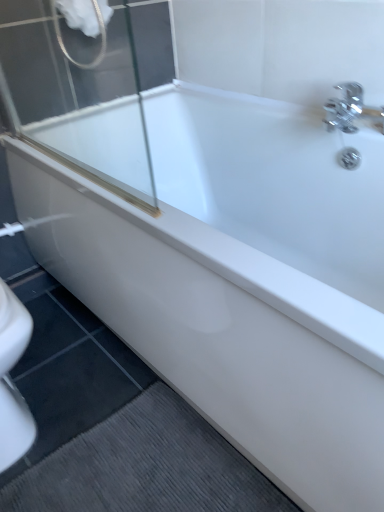
Question: From a real-world perspective, is white matte shower head at upper left beneath gray textured bath mat at lower left?

Choices:
 (A) yes
 (B) no

Answer: (B)

Question: Would you say white matte shower head at upper left is a long distance from gray textured bath mat at lower left?

Choices:
 (A) no
 (B) yes

Answer: (B)

Question: Is white matte shower head at upper left touching gray textured bath mat at lower left?

Choices:
 (A) no
 (B) yes

Answer: (A)

Question: Is white matte shower head at upper left aimed at gray textured bath mat at lower left?

Choices:
 (A) no
 (B) yes

Answer: (A)

Question: Can you confirm if white matte shower head at upper left is shorter than gray textured bath mat at lower left?

Choices:
 (A) yes
 (B) no

Answer: (B)

Question: Can you confirm if white matte shower head at upper left is positioned to the right of gray textured bath mat at lower left?

Choices:
 (A) yes
 (B) no

Answer: (B)

Question: Is gray textured bath mat at lower left directly adjacent to white matte shower head at upper left?

Choices:
 (A) no
 (B) yes

Answer: (A)

Question: Is gray textured bath mat at lower left not within white matte shower head at upper left?

Choices:
 (A) no
 (B) yes

Answer: (B)

Question: Can you confirm if gray textured bath mat at lower left is smaller than white matte shower head at upper left?

Choices:
 (A) yes
 (B) no

Answer: (A)

Question: Could white matte shower head at upper left be considered to be inside gray textured bath mat at lower left?

Choices:
 (A) no
 (B) yes

Answer: (A)

Question: Considering the relative positions of gray textured bath mat at lower left and white matte shower head at upper left in the image provided, is gray textured bath mat at lower left in front of white matte shower head at upper left?

Choices:
 (A) no
 (B) yes

Answer: (B)

Question: From a real-world perspective, does gray textured bath mat at lower left stand above white matte shower head at upper left?

Choices:
 (A) no
 (B) yes

Answer: (A)

Question: Is point (104, 41) positioned closer to the camera than point (175, 437)?

Choices:
 (A) farther
 (B) closer

Answer: (A)